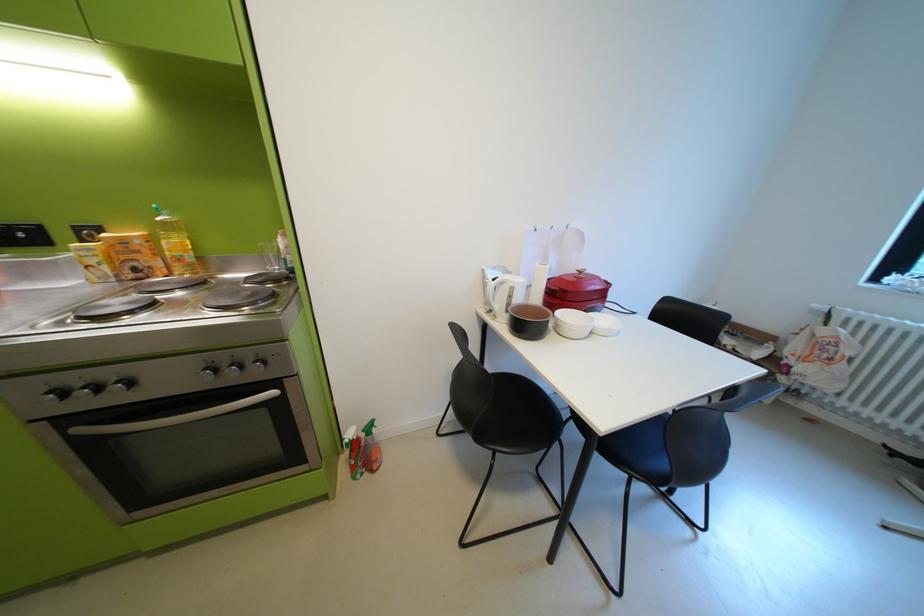
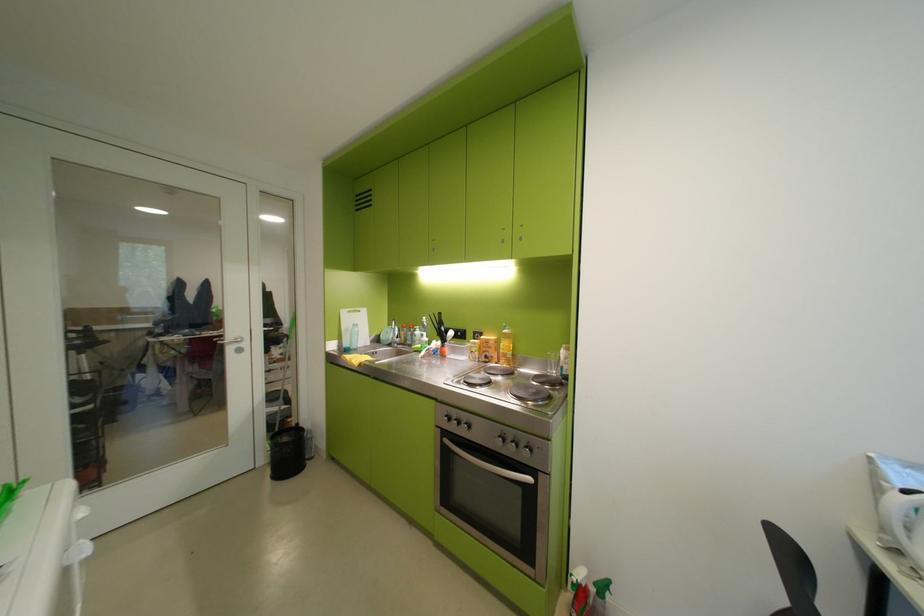
The point at (373, 432) is marked in the first image. Where is the corresponding point in the second image?

(604, 585)